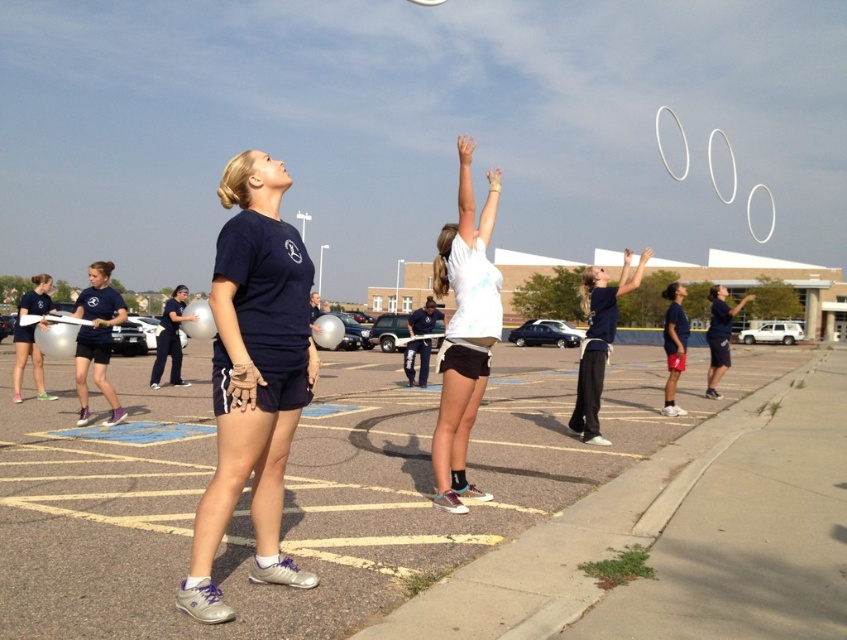
You are standing at the center of the parking lot and see a point marked at coordinates (x=253, y=378). Which object is located at this point?

The point at coordinates (x=253, y=378) corresponds to the navy blue tshirt at center.